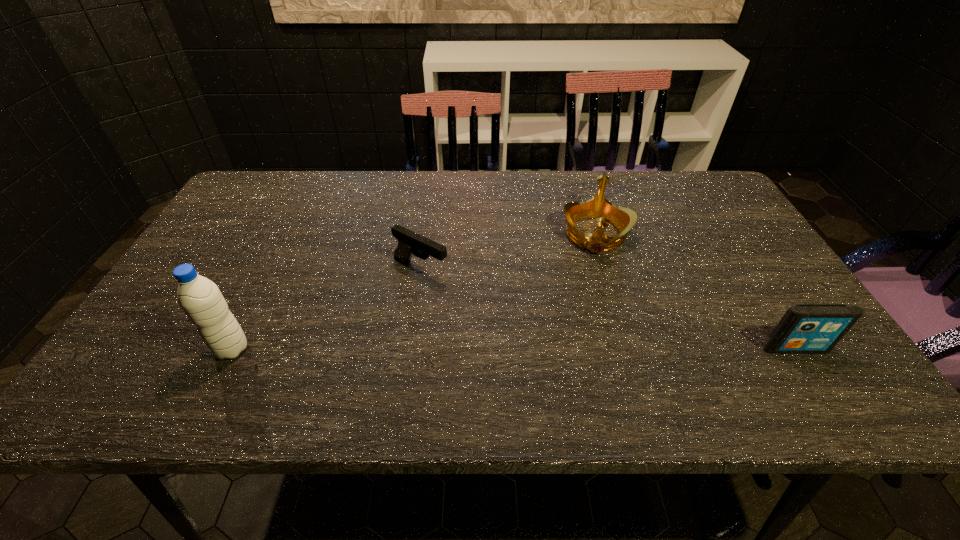
This screenshot has height=540, width=960. In order to click on the tallest object in this screenshot , I will do `click(200, 298)`.

The width and height of the screenshot is (960, 540). What are the coordinates of `the leftmost object` in the screenshot? It's located at (200, 298).

Where is `the rightmost object`? Image resolution: width=960 pixels, height=540 pixels. the rightmost object is located at coordinates (805, 328).

Locate an element on the screen. The width and height of the screenshot is (960, 540). the second object from right to left is located at coordinates (598, 207).

Where is `the shortest object`? This screenshot has height=540, width=960. the shortest object is located at coordinates (409, 242).

I want to click on the second object from left to right, so click(x=409, y=242).

Identify the location of vacant region located 0.070m on the right of the leftmost object. This screenshot has height=540, width=960. (281, 349).

This screenshot has width=960, height=540. In order to click on vacant space situated at the front emblem of the third object from left to right in this screenshot , I will do `click(593, 353)`.

Find the location of a particular element. This screenshot has height=540, width=960. free spot located at the front emblem of the third object from left to right is located at coordinates (594, 346).

Locate an element on the screen. free space located at the front emblem of the third object from left to right is located at coordinates (595, 285).